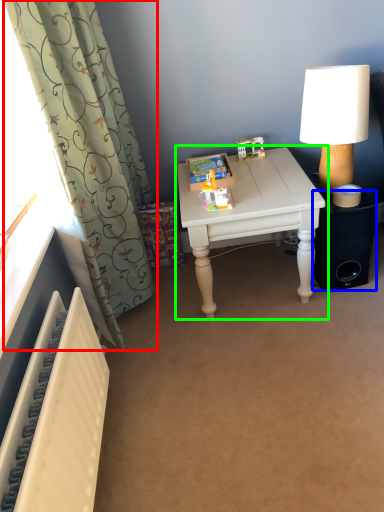
Question: Which object is the closest to the curtain (highlighted by a red box)? Choose among these: speaker (highlighted by a blue box) or table (highlighted by a green box).

Choices:
 (A) speaker
 (B) table

Answer: (B)